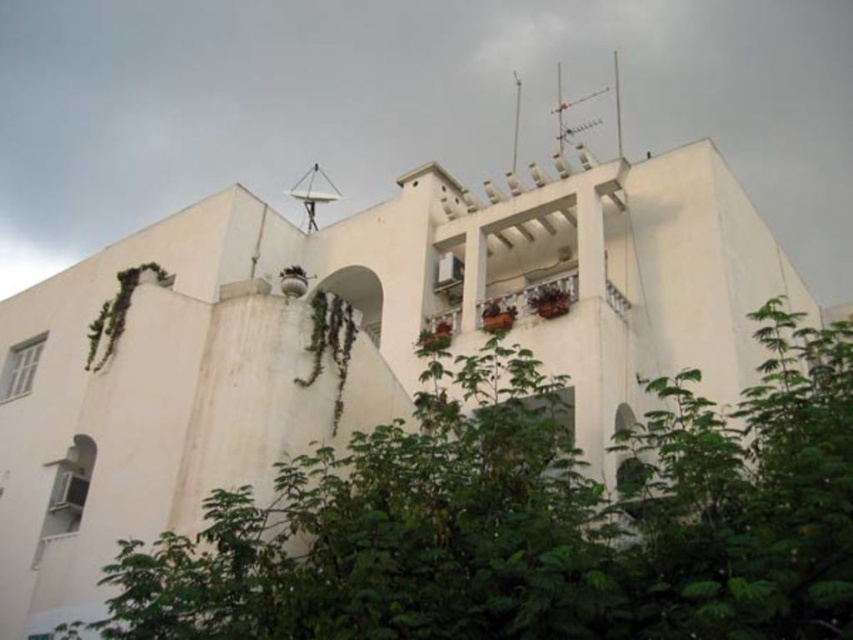
You are standing in front of the residential building and notice two plants in the scene. Which one, the green leafy tree at center or the green leafy plant at left, is positioned lower in the image?

The green leafy tree at center is positioned lower in the image because it is below the green leafy plant at left.

You are standing in front of the residential building and see the point marked as point (x=532, y=516). What does this point represent?

The point (x=532, y=516) represents the green leafy tree at center.

You are standing in front of the residential building and notice the green leafy tree at center. Based on its position coordinates, can you determine if the tree is closer to the front or the back of the building?

The green leafy tree at center is located at point (532, 516), which places it closer to the front of the building since the coordinates suggest it is positioned in the foreground relative to the building.